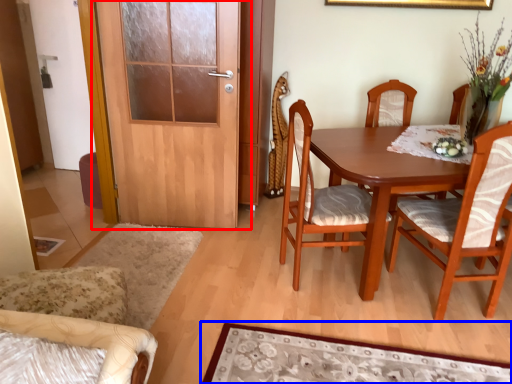
Question: Which of the following is the closest to the observer, door (highlighted by a red box) or mat (highlighted by a blue box)?

Choices:
 (A) door
 (B) mat

Answer: (B)